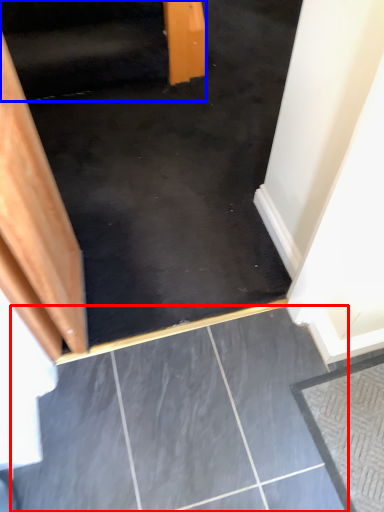
Question: Which point is further to the camera, concrete (highlighted by a red box) or stairwell (highlighted by a blue box)?

Choices:
 (A) concrete
 (B) stairwell

Answer: (B)